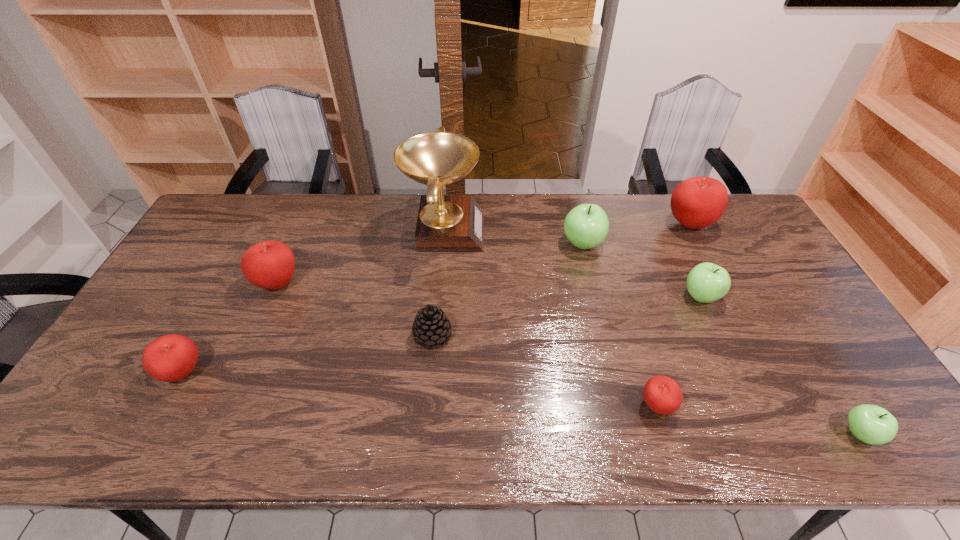
I want to click on the second green apple from right to left, so click(x=707, y=282).

The width and height of the screenshot is (960, 540). In order to click on the fourth nearest object in this screenshot , I will do `click(431, 327)`.

Locate an element on the screen. The height and width of the screenshot is (540, 960). the second red apple from right to left is located at coordinates (662, 394).

Where is `the rightmost object`? Image resolution: width=960 pixels, height=540 pixels. the rightmost object is located at coordinates [871, 424].

Image resolution: width=960 pixels, height=540 pixels. I want to click on the rightmost apple, so click(871, 424).

Where is `free location located on the front-facing side of the tallest object`? Image resolution: width=960 pixels, height=540 pixels. free location located on the front-facing side of the tallest object is located at coordinates (516, 229).

Locate an element on the screen. free spot located 0.400m on the front of the biggest red apple is located at coordinates (748, 339).

The image size is (960, 540). I want to click on blank space located on the right of the leftmost green apple, so click(x=709, y=244).

You are a GUI agent. You are given a task and a screenshot of the screen. Output one action in this format:
    pyautogui.click(x=<x>, y=<y>)
    Task: Click on the free space located 0.060m on the right of the third red apple from right to left
    The image size is (960, 540).
    Given the screenshot: What is the action you would take?
    pyautogui.click(x=322, y=284)

This screenshot has height=540, width=960. Identify the location of vacant space situated 0.380m on the right of the leftmost object. (x=355, y=373).